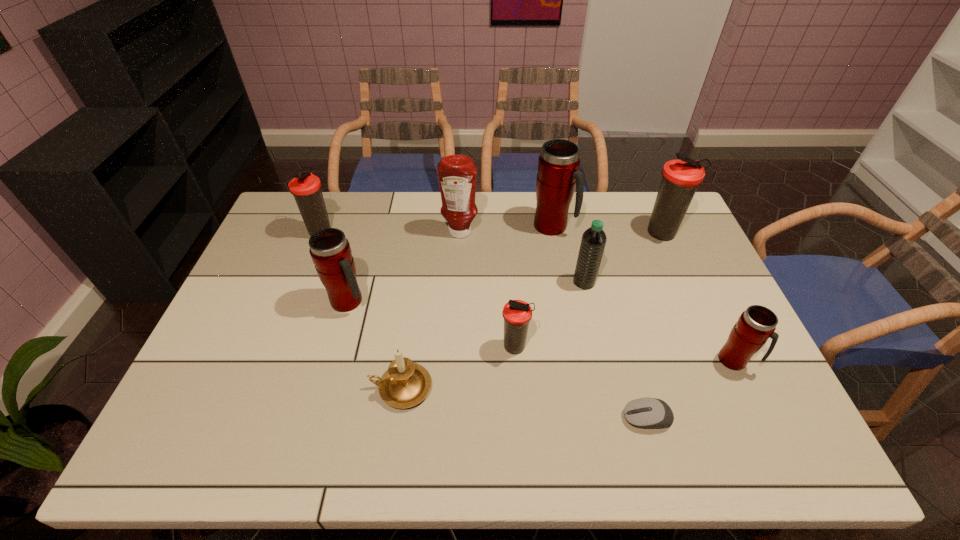
You are a GUI agent. You are given a task and a screenshot of the screen. Output one action in this format:
    pyautogui.click(x=<x>, y=<y>)
    Task: Click on the object that is at the left edge
    The height and width of the screenshot is (540, 960).
    Given the screenshot: What is the action you would take?
    pyautogui.click(x=306, y=188)

Locate an element on the screen. The height and width of the screenshot is (540, 960). object at the far left corner is located at coordinates (306, 188).

The image size is (960, 540). Find the location of `object at the far right corner`. object at the far right corner is located at coordinates (680, 178).

Where is `vacant space at the far edge of the desktop`? vacant space at the far edge of the desktop is located at coordinates (336, 200).

The width and height of the screenshot is (960, 540). In order to click on free location at the near edge of the desktop in this screenshot , I will do `click(581, 443)`.

The image size is (960, 540). Find the location of `vacant region at the left edge of the desktop`. vacant region at the left edge of the desktop is located at coordinates (233, 373).

At what (x,y) coordinates should I click in order to perform the action: click on free space at the right edge of the desktop. Please return your answer as a coordinate pair (x, y). Looking at the image, I should click on (686, 345).

Locate an element on the screen. This screenshot has width=960, height=540. blank area at the near left corner is located at coordinates (180, 441).

You are a GUI agent. You are given a task and a screenshot of the screen. Output one action in this format:
    pyautogui.click(x=<x>, y=<y>)
    Task: Click on the vacant space that's between the shortest object and the candle holder
    The image size is (960, 540).
    Given the screenshot: What is the action you would take?
    pyautogui.click(x=524, y=403)

Where is `free spot between the candle holder and the second thermos bottle from left to right`? The image size is (960, 540). free spot between the candle holder and the second thermos bottle from left to right is located at coordinates (374, 345).